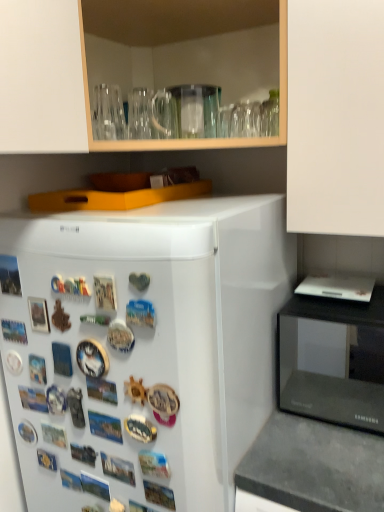
Question: From the image's perspective, relative to white glossy refrigerator at left, is black glossy microwave at right above or below?

Choices:
 (A) below
 (B) above

Answer: (B)

Question: Relative to white glossy refrigerator at left, is black glossy microwave at right in front or behind?

Choices:
 (A) behind
 (B) front

Answer: (A)

Question: Which object is positioned closest to the white glossy refrigerator at left?

Choices:
 (A) black glossy microwave at right
 (B) dark gray concrete counter top at lower right
 (C) transparent glass cabinet at upper center

Answer: (B)

Question: Estimate the real-world distances between objects in this image. Which object is farther from the transparent glass cabinet at upper center?

Choices:
 (A) black glossy microwave at right
 (B) dark gray concrete counter top at lower right
 (C) white glossy refrigerator at left

Answer: (A)